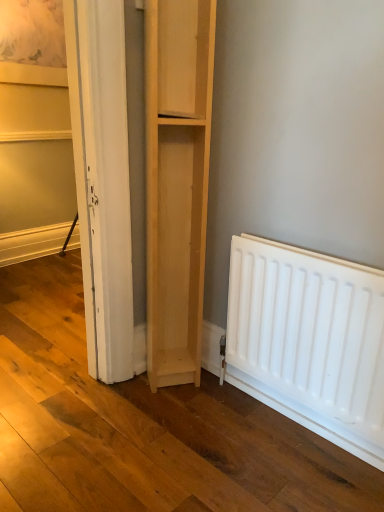
At what (x,y) coordinates should I click in order to perform the action: click on free location to the right of natural wood cupboard at center. Please return your answer as a coordinate pair (x, y). The image size is (384, 512). Looking at the image, I should click on (213, 395).